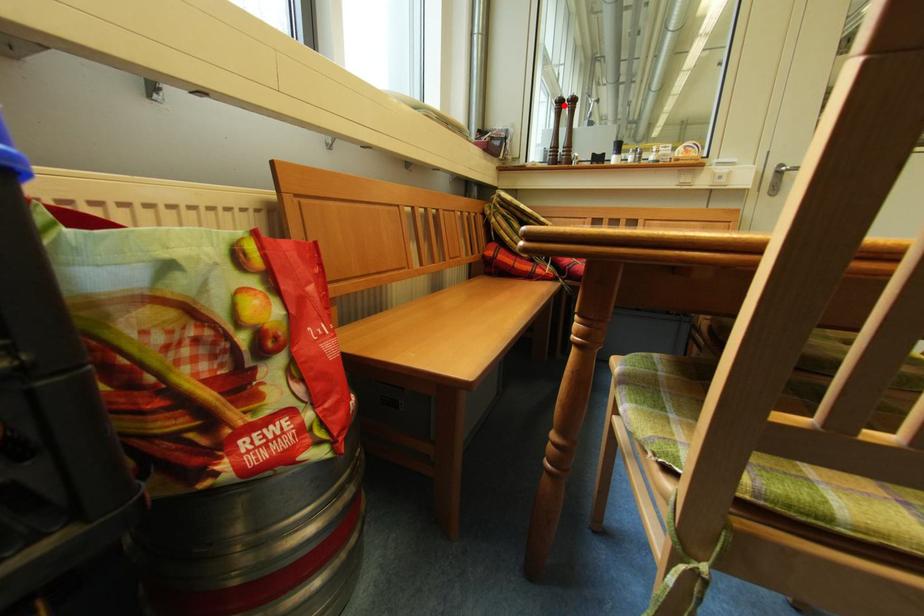
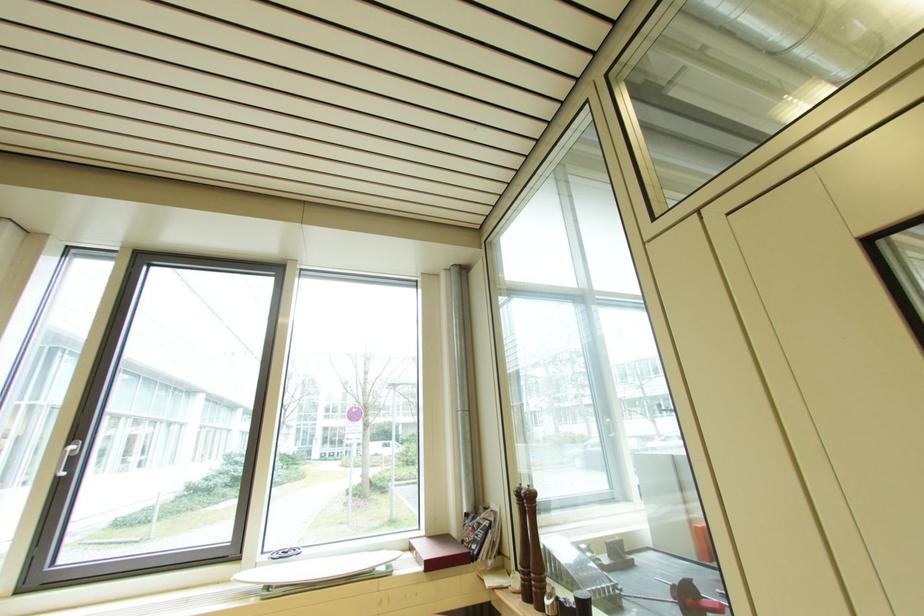
Where in the second image is the point corresponding to the highlighted location from the first image?

(524, 498)